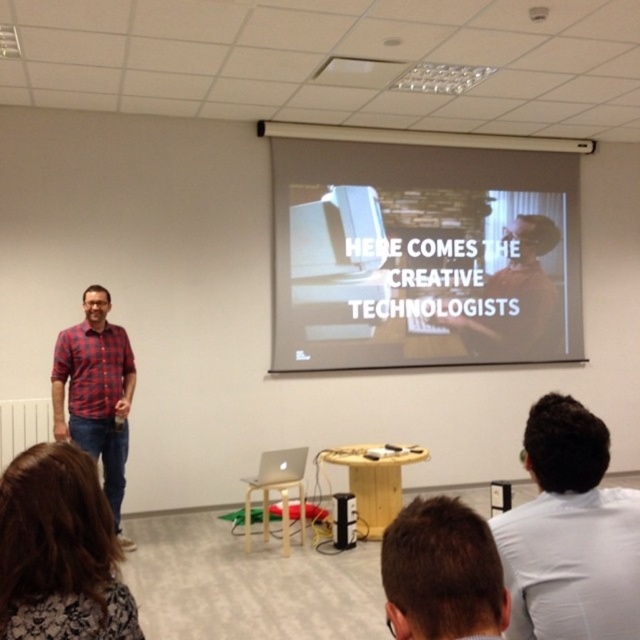
Question: Can you confirm if white matte projector screen at upper center is smaller than black plastic speaker at center?

Choices:
 (A) no
 (B) yes

Answer: (A)

Question: Which of the following is the farthest from the observer?

Choices:
 (A) white matte projector screen at upper center
 (B) white shirt at upper right

Answer: (A)

Question: Based on their relative distances, which object is farther from the white shirt at upper right?

Choices:
 (A) brown hair at center
 (B) red plaid shirt at left
 (C) white matte projector screen at upper center
 (D) black plastic speaker at center

Answer: (C)

Question: Which is nearer to the brown hair at lower left?

Choices:
 (A) white shirt at upper right
 (B) black plastic speaker at center

Answer: (A)

Question: Does brown hair at lower left have a lesser width compared to black plastic speaker at center?

Choices:
 (A) no
 (B) yes

Answer: (A)

Question: Does brown hair at center appear under matte black laptop at center?

Choices:
 (A) yes
 (B) no

Answer: (A)